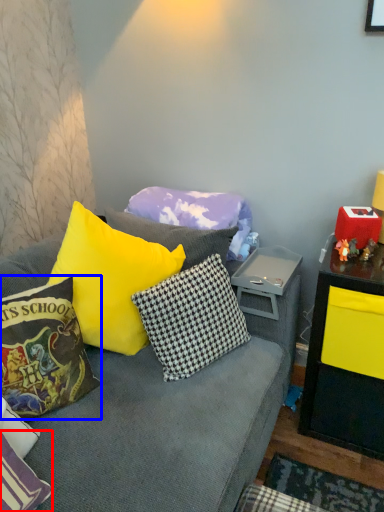
Question: Which of the following is the closest to the observer, pillow (highlighted by a red box) or pillow (highlighted by a blue box)?

Choices:
 (A) pillow
 (B) pillow

Answer: (A)